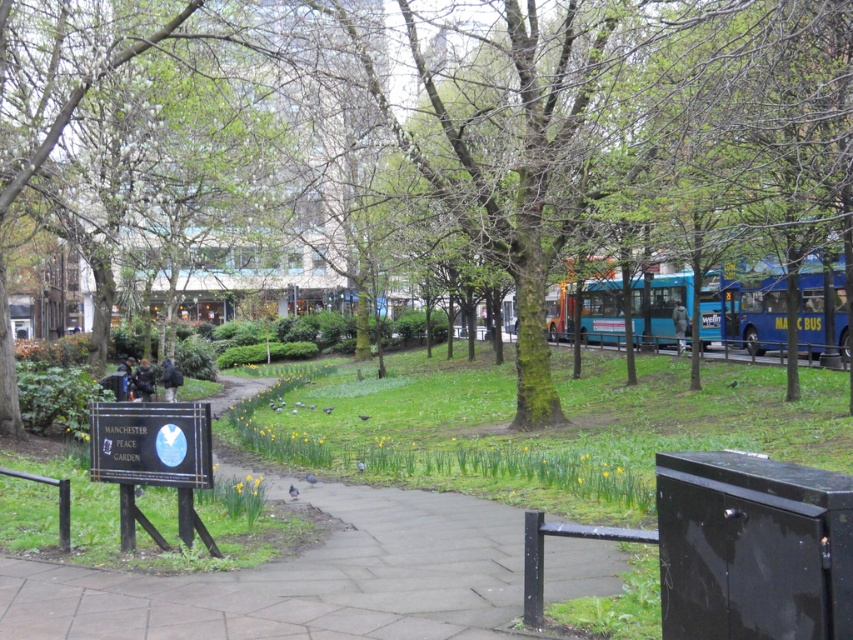
Question: Which object is farther from the camera taking this photo?

Choices:
 (A) blue metallic bus at center
 (B) blue metallic bus at right
 (C) green mossy tree at center

Answer: (A)

Question: Among these points, which one is farthest from the camera?

Choices:
 (A) (844, 321)
 (B) (717, 321)
 (C) (15, 177)
 (D) (106, 417)

Answer: (B)

Question: Considering the relative positions of green mossy tree at center and wooden sign at lower left in the image provided, where is green mossy tree at center located with respect to wooden sign at lower left?

Choices:
 (A) above
 (B) below

Answer: (A)

Question: From the image, what is the correct spatial relationship of blue metallic bus at right in relation to blue metallic bus at center?

Choices:
 (A) above
 (B) below

Answer: (B)

Question: Considering the real-world distances, which object is closest to the blue metallic bus at right?

Choices:
 (A) blue metallic bus at center
 (B) green mossy tree at center

Answer: (A)

Question: Is green mossy tree at center below blue metallic bus at center?

Choices:
 (A) yes
 (B) no

Answer: (B)